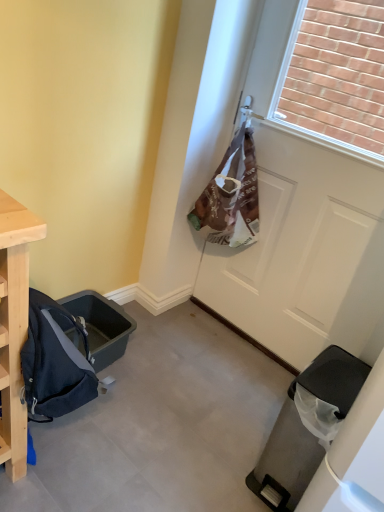
At what (x,y) coordinates should I click in order to perform the action: click on vacant region above black plastic trash can at lower right (from a real-world perspective). Please return your answer as a coordinate pair (x, y). The image size is (384, 512). Looking at the image, I should click on (337, 377).